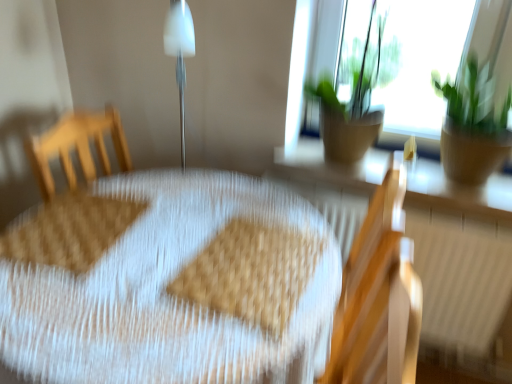
Question: Considering the positions of wooden radiator at lower right and brown textured pot at upper right, which appears as the 1th houseplant when viewed from the left, in the image, is wooden radiator at lower right taller or shorter than brown textured pot at upper right, which appears as the 1th houseplant when viewed from the left,?

Choices:
 (A) tall
 (B) short

Answer: (A)

Question: Does point (348, 220) appear closer or farther from the camera than point (345, 97)?

Choices:
 (A) farther
 (B) closer

Answer: (B)

Question: Based on their relative distances, which object is farther from the wooden chair at right?

Choices:
 (A) green leafy plant at upper right, the second houseplant when ordered from left to right
 (B) matte brown wood at upper right
 (C) brown textured pot at upper right, which appears as the 1th houseplant when viewed from the left
 (D) wooden radiator at lower right
 (E) white woven table at center

Answer: (C)

Question: Which object is positioned farthest from the white woven table at center?

Choices:
 (A) green leafy plant at upper right, arranged as the first houseplant when viewed from the right
 (B) wooden radiator at lower right
 (C) brown textured pot at upper right, which appears as the 1th houseplant when viewed from the left
 (D) matte brown wood at upper right
 (E) wooden chair at right

Answer: (A)